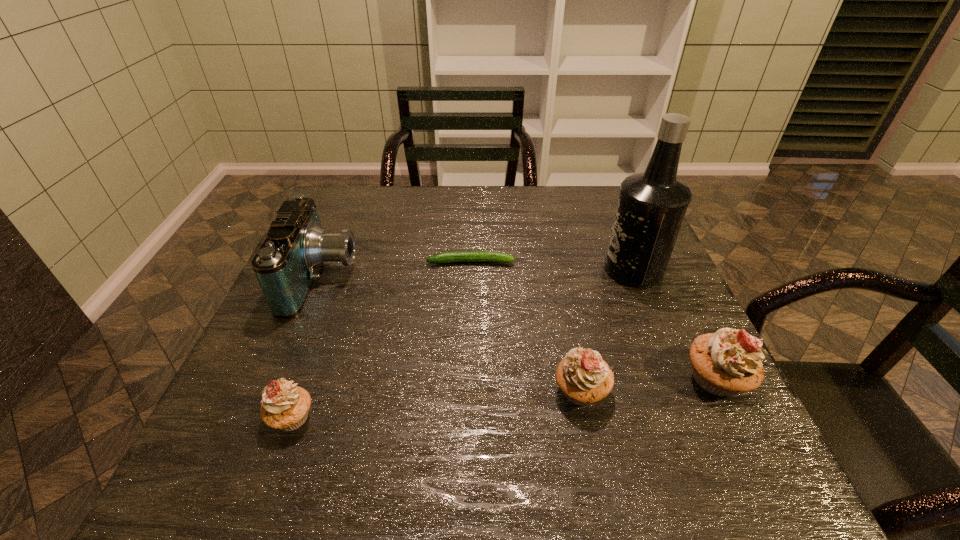
Identify which cupcake is the nearest to the camcorder. Please provide its 2D coordinates. Your answer should be formatted as a tuple, i.e. [(x, y)], where the tuple contains the x and y coordinates of a point satisfying the conditions above.

[(285, 406)]

Locate an element on the screen. vacant space that satisfies the following two spatial constraints: 1. on the back side of the tallest cupcake; 2. on the front-facing side of the camcorder is located at coordinates (667, 278).

The height and width of the screenshot is (540, 960). Identify the location of free space that satisfies the following two spatial constraints: 1. on the front-facing side of the camcorder; 2. on the back side of the tallest cupcake. (280, 379).

Identify the location of vacant point that satisfies the following two spatial constraints: 1. on the front-facing side of the camcorder; 2. on the back side of the rightmost cupcake. (280, 379).

The image size is (960, 540). Identify the location of free location that satisfies the following two spatial constraints: 1. on the front-facing side of the shortest object; 2. on the back side of the second shortest cupcake. 468,391.

Find the location of a particular element. The width and height of the screenshot is (960, 540). free location that satisfies the following two spatial constraints: 1. on the front-facing side of the zucchini; 2. on the right side of the third object from right to left is located at coordinates (468, 391).

At what (x,y) coordinates should I click in order to perform the action: click on vacant region that satisfies the following two spatial constraints: 1. on the back side of the fourth object from left to right; 2. on the front-facing side of the shortest object. Please return your answer as a coordinate pair (x, y). The image size is (960, 540). Looking at the image, I should click on (555, 262).

At what (x,y) coordinates should I click in order to perform the action: click on vacant area that satisfies the following two spatial constraints: 1. on the front-facing side of the tallest cupcake; 2. on the right side of the fourth object from right to left. Please return your answer as a coordinate pair (x, y). The width and height of the screenshot is (960, 540). Looking at the image, I should click on (468, 379).

Image resolution: width=960 pixels, height=540 pixels. I want to click on vacant space that satisfies the following two spatial constraints: 1. on the front label of the liquor; 2. on the back side of the rightmost cupcake, so click(x=678, y=379).

Locate an element on the screen. Image resolution: width=960 pixels, height=540 pixels. vacant area that satisfies the following two spatial constraints: 1. on the front-facing side of the camcorder; 2. on the left side of the shortest cupcake is located at coordinates (265, 418).